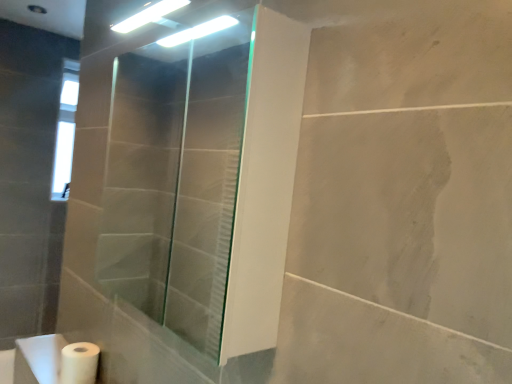
Question: From the image's perspective, is white matte toilet paper at lower left located beneath transparent glass shower door at center?

Choices:
 (A) yes
 (B) no

Answer: (A)

Question: Is white matte toilet paper at lower left wider than transparent glass shower door at center?

Choices:
 (A) yes
 (B) no

Answer: (B)

Question: Is white matte toilet paper at lower left thinner than transparent glass shower door at center?

Choices:
 (A) yes
 (B) no

Answer: (A)

Question: From the image's perspective, is white matte toilet paper at lower left above transparent glass shower door at center?

Choices:
 (A) no
 (B) yes

Answer: (A)

Question: Is white matte toilet paper at lower left positioned with its back to transparent glass shower door at center?

Choices:
 (A) no
 (B) yes

Answer: (A)

Question: Is white matte toilet paper at lower left bigger than transparent glass shower door at center?

Choices:
 (A) yes
 (B) no

Answer: (B)

Question: Is transparent glass shower door at center not near white matte toilet paper at lower left?

Choices:
 (A) yes
 (B) no

Answer: (A)

Question: Is white matte toilet paper at lower left a part of transparent glass shower door at center?

Choices:
 (A) no
 (B) yes

Answer: (A)

Question: Is transparent glass shower door at center positioned with its back to white matte toilet paper at lower left?

Choices:
 (A) yes
 (B) no

Answer: (B)

Question: Considering the relative sizes of transparent glass shower door at center and white matte toilet paper at lower left in the image provided, is transparent glass shower door at center wider than white matte toilet paper at lower left?

Choices:
 (A) no
 (B) yes

Answer: (B)

Question: From a real-world perspective, is transparent glass shower door at center on top of white matte toilet paper at lower left?

Choices:
 (A) yes
 (B) no

Answer: (A)

Question: From the image's perspective, is transparent glass shower door at center beneath white matte toilet paper at lower left?

Choices:
 (A) yes
 (B) no

Answer: (B)

Question: Is transparent glass shower door at center further to the viewer compared to white matte sink at lower left?

Choices:
 (A) yes
 (B) no

Answer: (B)